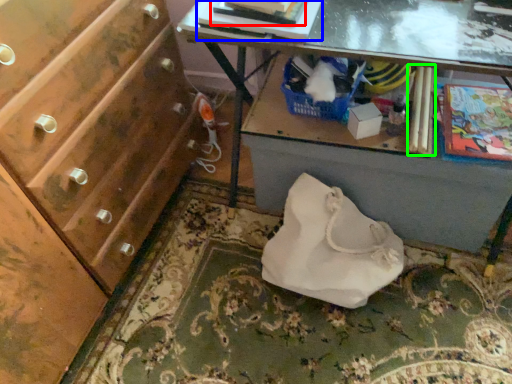
Question: Which is farther away from magazine (highlighted by a red box)? book (highlighted by a blue box) or magazine (highlighted by a green box)?

Choices:
 (A) book
 (B) magazine

Answer: (B)